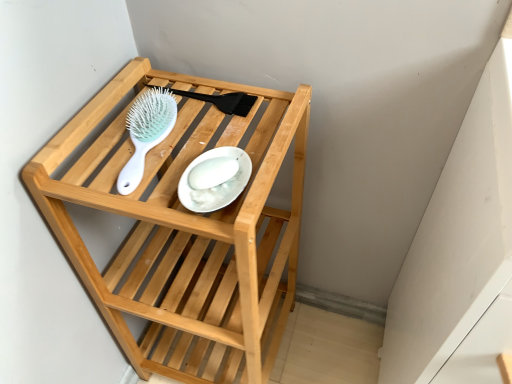
What is the approximate width of white glossy plate at center?

white glossy plate at center is 5.09 inches in width.

Find the location of a particular element. The width and height of the screenshot is (512, 384). light blue plastic hairbrush at upper center is located at coordinates (146, 132).

Find the location of a particular element. white glossy plate at center is located at coordinates (215, 185).

Between natural wood shelf at center and white glossy plate at center, which one has more height?

natural wood shelf at center.

Can you confirm if natural wood shelf at center is bigger than white glossy plate at center?

Indeed, natural wood shelf at center has a larger size compared to white glossy plate at center.

The image size is (512, 384). In order to click on plate above the natural wood shelf at center (from a real-world perspective) in this screenshot , I will do `click(215, 185)`.

From a real-world perspective, is light blue plastic hairbrush at upper center over natural wood shelf at center?

Yes, from a real-world perspective, light blue plastic hairbrush at upper center is over natural wood shelf at center

From the image's perspective, which object appears higher, light blue plastic hairbrush at upper center or natural wood shelf at center?

light blue plastic hairbrush at upper center is shown above in the image.

Considering the relative positions of light blue plastic hairbrush at upper center and natural wood shelf at center in the image provided, is light blue plastic hairbrush at upper center to the left of natural wood shelf at center from the viewer's perspective?

Correct, you'll find light blue plastic hairbrush at upper center to the left of natural wood shelf at center.

From the image's perspective, is natural wood shelf at center located above light blue plastic hairbrush at upper center?

No, from the image's perspective, natural wood shelf at center is not on top of light blue plastic hairbrush at upper center.

Consider the image. Is natural wood shelf at center oriented towards light blue plastic hairbrush at upper center?

No, natural wood shelf at center is not facing towards light blue plastic hairbrush at upper center.

From a real-world perspective, which object stands above the other?

light blue plastic hairbrush at upper center, from a real-world perspective.

How many degrees apart are the facing directions of natural wood shelf at center and light blue plastic hairbrush at upper center?

5.11 degrees separate the facing orientations of natural wood shelf at center and light blue plastic hairbrush at upper center.

Is white glossy plate at center aimed at natural wood shelf at center?

Yes, white glossy plate at center is oriented towards natural wood shelf at center.

Is white glossy plate at center to the right of natural wood shelf at center from the viewer's perspective?

Yes.

In terms of height, does white glossy plate at center look taller or shorter compared to natural wood shelf at center?

In the image, white glossy plate at center appears to be shorter than natural wood shelf at center.

Is white glossy plate at center not near natural wood shelf at center?

Actually, white glossy plate at center and natural wood shelf at center are a little close together.

Considering the relative sizes of white glossy plate at center and light blue plastic hairbrush at upper center in the image provided, is white glossy plate at center smaller than light blue plastic hairbrush at upper center?

Yes.

From the image's perspective, is white glossy plate at center on top of light blue plastic hairbrush at upper center?

Incorrect, from the image's perspective, white glossy plate at center is lower than light blue plastic hairbrush at upper center.

How different are the orientations of white glossy plate at center and light blue plastic hairbrush at upper center in degrees?

The angle between the facing direction of white glossy plate at center and the facing direction of light blue plastic hairbrush at upper center is 4.64 degrees.

Considering the positions of points (210, 152) and (119, 175), is point (210, 152) closer to camera compared to point (119, 175)?

No.

Does light blue plastic hairbrush at upper center have a smaller size compared to white glossy plate at center?

Actually, light blue plastic hairbrush at upper center might be larger than white glossy plate at center.

Is the position of light blue plastic hairbrush at upper center less distant than that of white glossy plate at center?

No, light blue plastic hairbrush at upper center is further to the viewer.

Is light blue plastic hairbrush at upper center next to white glossy plate at center?

No.

Based on the photo, is light blue plastic hairbrush at upper center not inside white glossy plate at center?

Absolutely, light blue plastic hairbrush at upper center is external to white glossy plate at center.

In order to click on furniture that appears below the white glossy plate at center (from the image's perspective) in this screenshot , I will do `click(185, 231)`.

Where is `brush behind the natural wood shelf at center`? The width and height of the screenshot is (512, 384). brush behind the natural wood shelf at center is located at coordinates (146, 132).

From the image, which object appears to be nearer to natural wood shelf at center, white glossy plate at center or light blue plastic hairbrush at upper center?

light blue plastic hairbrush at upper center is closer to natural wood shelf at center.

Estimate the real-world distances between objects in this image. Which object is further from white glossy plate at center, light blue plastic hairbrush at upper center or natural wood shelf at center?

natural wood shelf at center is positioned further to the anchor white glossy plate at center.

Estimate the real-world distances between objects in this image. Which object is closer to white glossy plate at center, natural wood shelf at center or light blue plastic hairbrush at upper center?

light blue plastic hairbrush at upper center is positioned closer to the anchor white glossy plate at center.

Consider the image. Looking at the image, which one is located closer to light blue plastic hairbrush at upper center, white glossy plate at center or natural wood shelf at center?

white glossy plate at center.

Estimate the real-world distances between objects in this image. Which object is closer to natural wood shelf at center, light blue plastic hairbrush at upper center or white glossy plate at center?

Among the two, light blue plastic hairbrush at upper center is located nearer to natural wood shelf at center.

From the picture: Estimate the real-world distances between objects in this image. Which object is further from light blue plastic hairbrush at upper center, natural wood shelf at center or white glossy plate at center?

natural wood shelf at center lies further to light blue plastic hairbrush at upper center than the other object.

Identify the location of plate between light blue plastic hairbrush at upper center and natural wood shelf at center vertically. (215, 185).